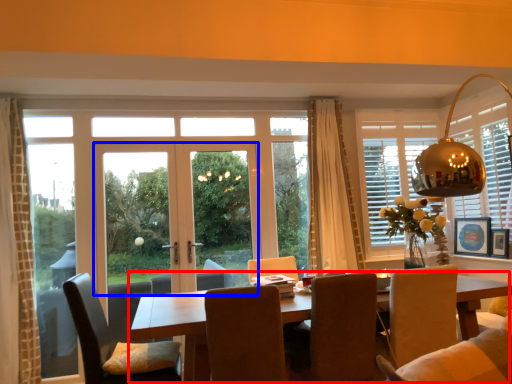
Question: Which object is further to the camera taking this photo, kitchen & dining room table (highlighted by a red box) or door (highlighted by a blue box)?

Choices:
 (A) kitchen & dining room table
 (B) door

Answer: (B)